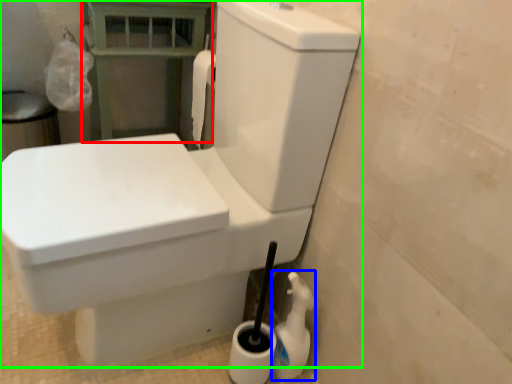
Question: Which object is positioned farthest from balustrade (highlighted by a red box)? Select from cleaning product (highlighted by a blue box) and toilet (highlighted by a green box).

Choices:
 (A) cleaning product
 (B) toilet

Answer: (A)